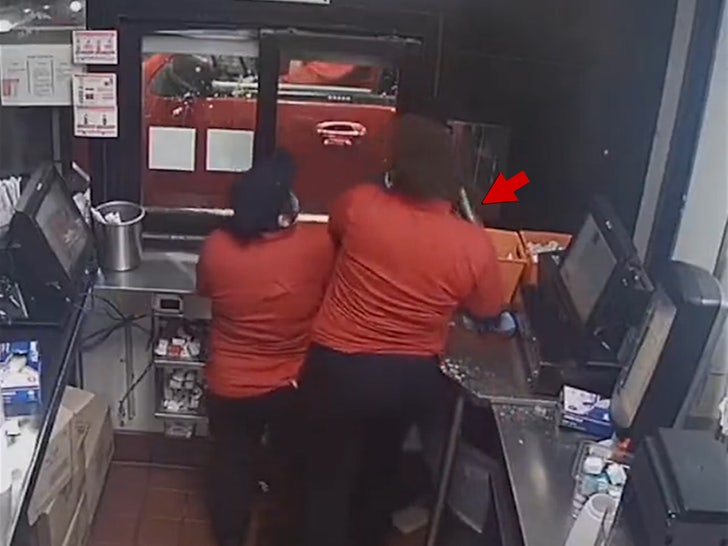
Where is `napkin`? napkin is located at coordinates (694, 490).